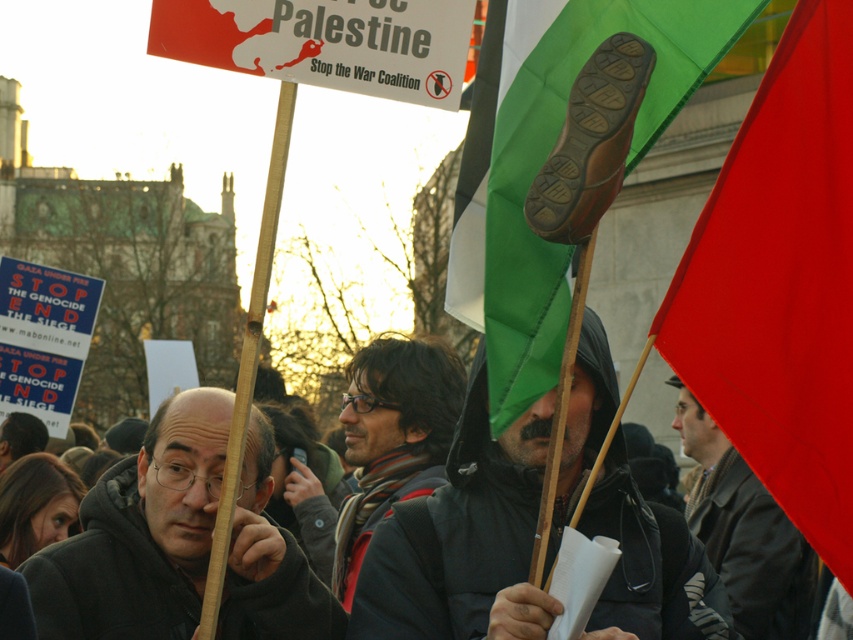
Question: Does black matte jacket at center appear under dark gray scarf at center?

Choices:
 (A) no
 (B) yes

Answer: (A)

Question: Is black matte jacket at center above dark gray scarf at center?

Choices:
 (A) no
 (B) yes

Answer: (B)

Question: Which point is farther to the camera?

Choices:
 (A) click(x=792, y=620)
 (B) click(x=440, y=384)
 (C) click(x=717, y=582)

Answer: (B)

Question: Which of the following is the farthest from the observer?

Choices:
 (A) matte black hoodie at center
 (B) red fabric flag at upper right
 (C) green fabric flag at upper center

Answer: (A)

Question: Based on their relative distances, which object is farther from the green fabric flag at upper center?

Choices:
 (A) brown wool coat at right
 (B) black matte jacket at center
 (C) red fabric flag at upper right

Answer: (A)

Question: Is red fabric flag at upper right to the left of dark gray scarf at center from the viewer's perspective?

Choices:
 (A) yes
 (B) no

Answer: (B)